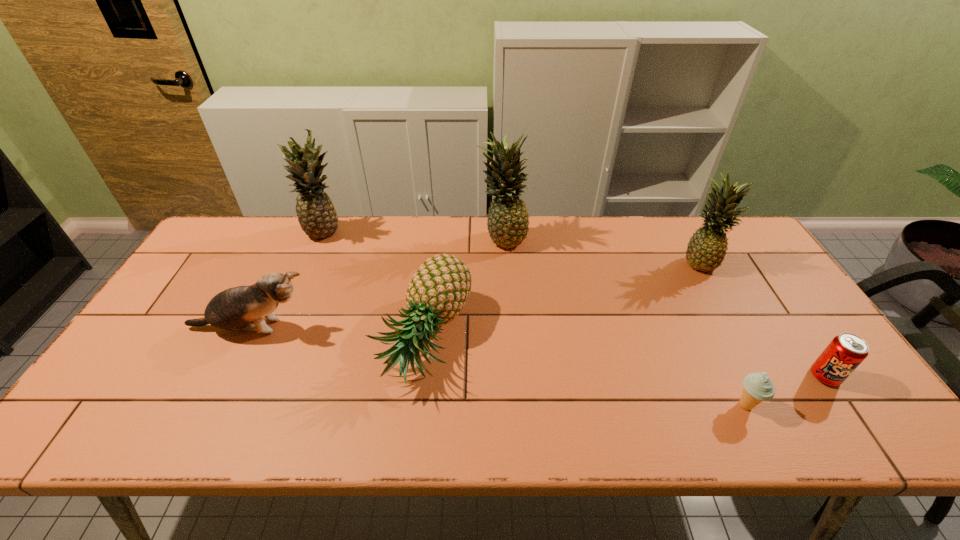
Locate an element on the screen. vacant space located 0.060m on the left of the leftmost pineapple is located at coordinates (285, 234).

What are the coordinates of `free space located on the front of the second shortest pineapple` in the screenshot? It's located at (772, 390).

Locate an element on the screen. Image resolution: width=960 pixels, height=540 pixels. free space located on the left of the nearest pineapple is located at coordinates (248, 337).

Where is `free location located 0.140m at the face of the cat`? This screenshot has width=960, height=540. free location located 0.140m at the face of the cat is located at coordinates (368, 328).

The width and height of the screenshot is (960, 540). What are the coordinates of `free space located on the left of the rightmost object` in the screenshot? It's located at (683, 376).

The width and height of the screenshot is (960, 540). In order to click on vacant region located on the back of the icecream in this screenshot , I will do `click(706, 325)`.

The height and width of the screenshot is (540, 960). In order to click on object that is at the near edge in this screenshot , I will do `click(758, 387)`.

Where is `object at the left edge`? The height and width of the screenshot is (540, 960). object at the left edge is located at coordinates (233, 309).

Locate an element on the screen. The image size is (960, 540). pineapple that is at the right edge is located at coordinates (706, 250).

You are a GUI agent. You are given a task and a screenshot of the screen. Output one action in this format:
    pyautogui.click(x=<x>, y=<y>)
    Task: Click on the soda can present at the right edge
    The image size is (960, 540).
    Given the screenshot: What is the action you would take?
    pyautogui.click(x=845, y=352)